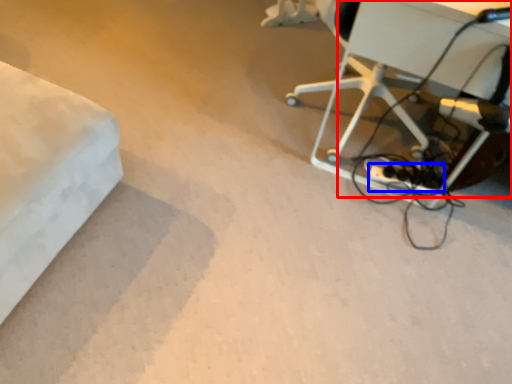
Question: Among these objects, which one is nearest to the camera, table (highlighted by a red box) or extension cord (highlighted by a blue box)?

Choices:
 (A) table
 (B) extension cord

Answer: (A)